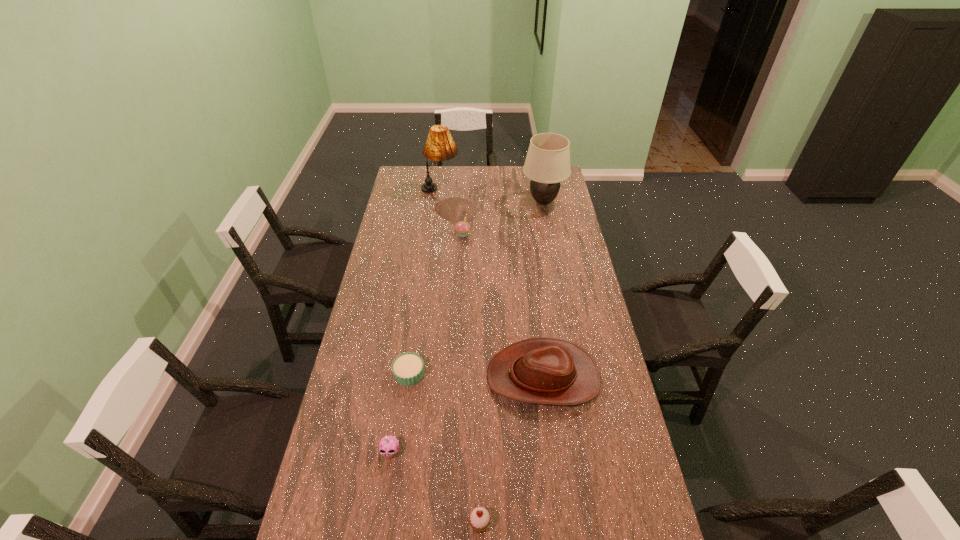
I want to click on vacant area located on the front-facing side of the left lampshade, so click(493, 191).

Where is `free spot located 0.050m on the back of the right lampshade`? The image size is (960, 540). free spot located 0.050m on the back of the right lampshade is located at coordinates (540, 185).

Where is `vacant space situated 0.240m on the left of the third farthest object`? This screenshot has height=540, width=960. vacant space situated 0.240m on the left of the third farthest object is located at coordinates (403, 234).

This screenshot has width=960, height=540. I want to click on free space located on the front-facing side of the cowboy hat, so click(x=464, y=377).

The height and width of the screenshot is (540, 960). In order to click on free point located on the front-facing side of the cowboy hat in this screenshot , I will do `click(449, 377)`.

The image size is (960, 540). Find the location of `free location located on the front-facing side of the cowboy hat`. free location located on the front-facing side of the cowboy hat is located at coordinates (381, 377).

Image resolution: width=960 pixels, height=540 pixels. Find the location of `vacant space situated 0.160m on the face of the second nearest cupcake`. vacant space situated 0.160m on the face of the second nearest cupcake is located at coordinates (x=380, y=521).

Locate an element on the screen. vacant area located on the left of the nearest object is located at coordinates (404, 524).

You are a GUI agent. You are given a task and a screenshot of the screen. Output one action in this format:
    pyautogui.click(x=<x>, y=<y>)
    Task: Click on the vacant space located on the left of the shortest object
    The height and width of the screenshot is (540, 960).
    Given the screenshot: What is the action you would take?
    [361, 375]

Identify the location of object located in the far edge section of the desktop. (440, 146).